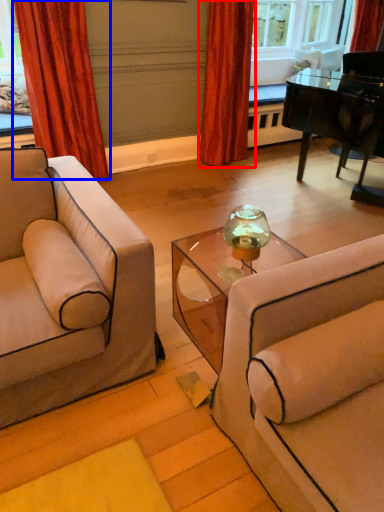
Question: Which point is further to the camera, curtain (highlighted by a red box) or curtain (highlighted by a blue box)?

Choices:
 (A) curtain
 (B) curtain

Answer: (A)